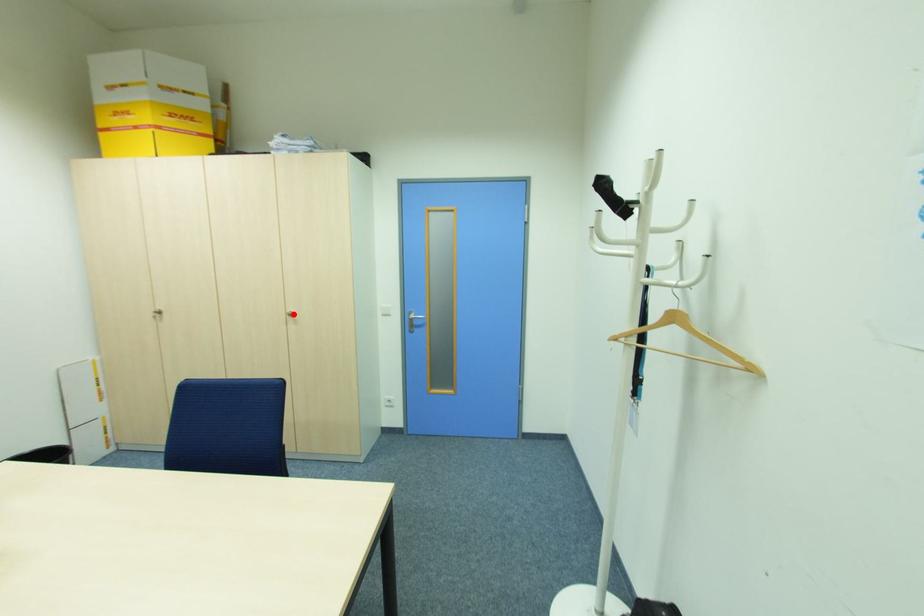
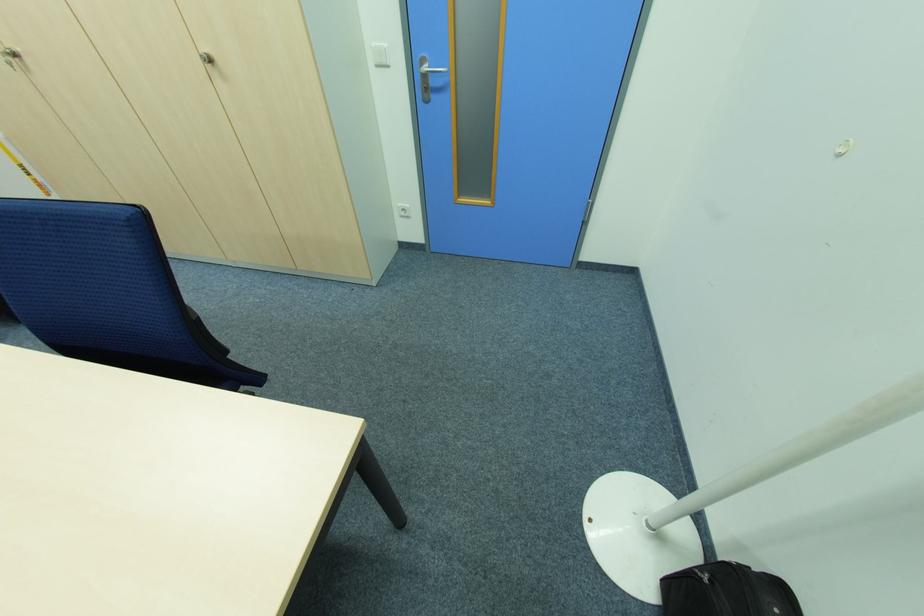
Locate, in the second image, the point that corresponds to the highlighted location in the first image.

(213, 62)